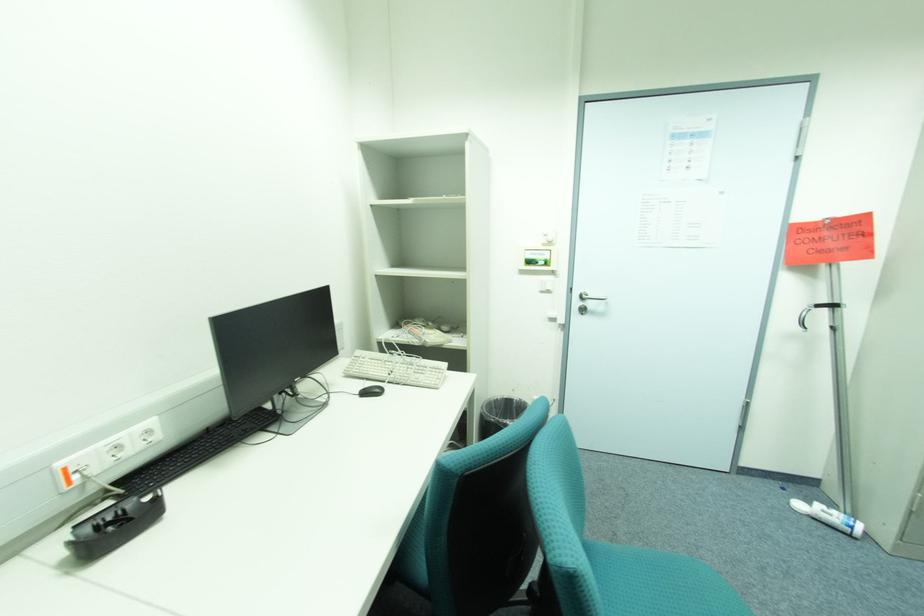
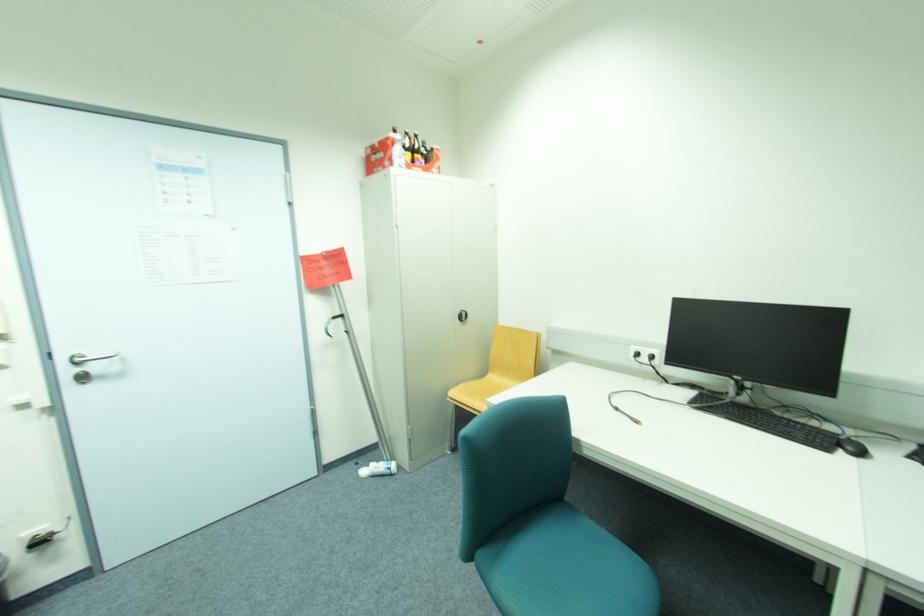
Find the pixel in the second image that matches the point at 816,503 in the first image.

(373, 468)